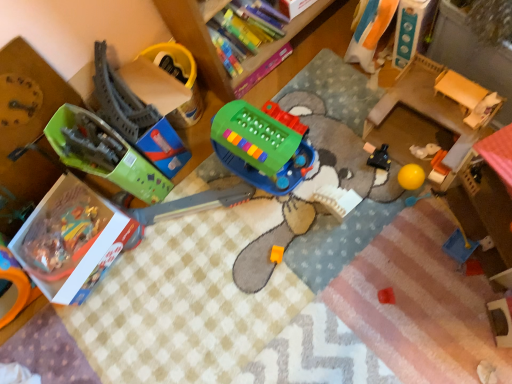
Where is `vacant location behind black plastic toy at center-right, the second toy when ordered from right to left`? This screenshot has height=384, width=512. vacant location behind black plastic toy at center-right, the second toy when ordered from right to left is located at coordinates (349, 121).